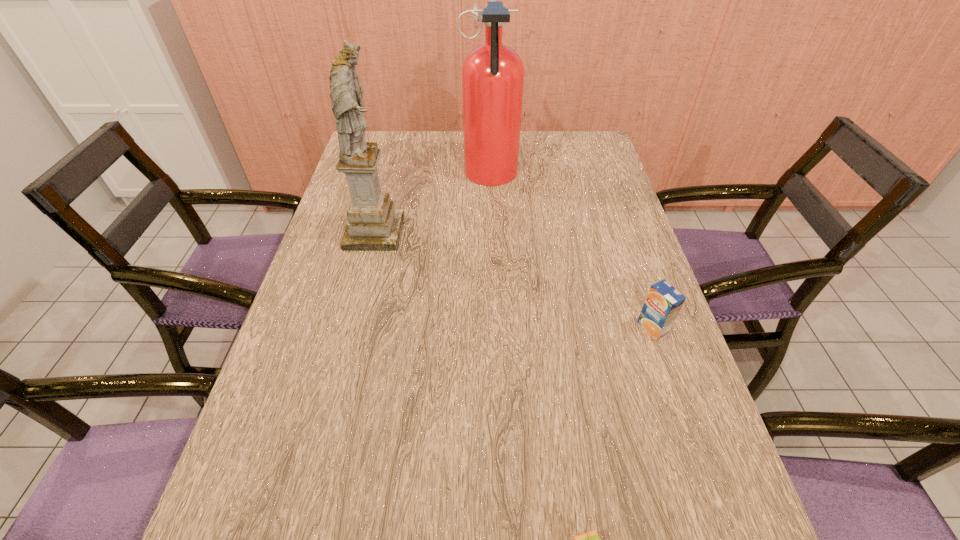
This screenshot has height=540, width=960. What are the coordinates of `object at the left edge` in the screenshot? It's located at point(374,224).

This screenshot has width=960, height=540. Identify the location of object present at the right edge. (663, 303).

The image size is (960, 540). I want to click on free spot at the left edge of the desktop, so click(x=354, y=316).

Where is `vacant space at the right edge`? The image size is (960, 540). vacant space at the right edge is located at coordinates (692, 442).

Locate an element on the screen. vacant space that's between the leftmost object and the farther orange juice is located at coordinates (514, 280).

This screenshot has height=540, width=960. What are the coordinates of `unoccupied position between the farther orange juice and the fire extinguisher` in the screenshot? It's located at (571, 252).

Find the location of `free area in between the farther orange juice and the third nearest object`. free area in between the farther orange juice and the third nearest object is located at coordinates (514, 280).

Find the location of a particular element. vacant space that is in between the fire extinguisher and the taller orange juice is located at coordinates (571, 252).

Locate an element on the screen. The width and height of the screenshot is (960, 540). vacant region between the third farthest object and the leftmost object is located at coordinates coord(514,280).

Locate an element on the screen. The width and height of the screenshot is (960, 540). vacant area that lies between the third farthest object and the leftmost object is located at coordinates (514, 280).